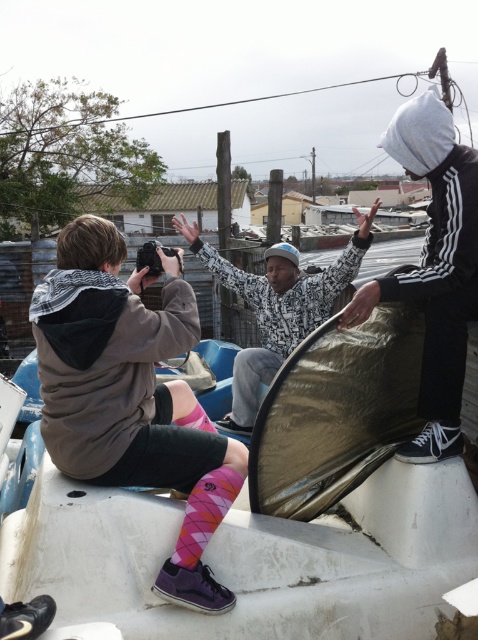
You are a photographer trying to capture a photo of both the pink argyle socks at lower left and the white textured jacket at center. Based on their positions, which object should be focused on first to ensure both are in frame?

The pink argyle socks at lower left is in front of the white textured jacket at center, so you should focus on the pink argyle socks at lower left first to ensure both are in frame.

You are a photographer trying to capture a candid shot of the person wearing the pink argyle socks at lower left. The camera is positioned 6.10 feet away from them. Considering typical camera focal lengths, would a standard 50mm lens or a wide angle 24mm lens be more appropriate to include both the subject and the surrounding urban background in the frame?

The pink argyle socks at lower left are 6.10 feet away from the camera. A wide angle 24mm lens would be more appropriate as it captures a wider field of view, allowing both the subject and the surrounding urban background to be included in the frame compared to a standard 50mm lens.